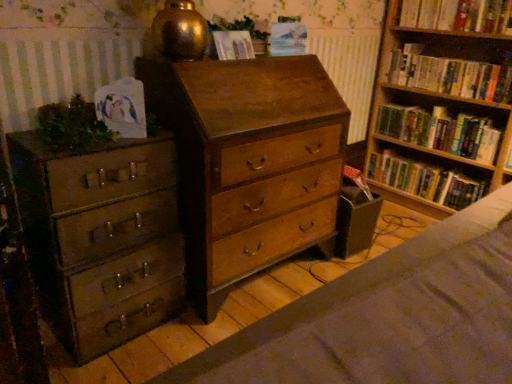
Question: Considering their positions, is wooden chest of drawers at center, acting as the second chest of drawers starting from the left, located in front of or behind hardcover books at right, which is the second book in top-to-bottom order?

Choices:
 (A) front
 (B) behind

Answer: (A)

Question: Looking at the image, does wooden chest of drawers at center, acting as the second chest of drawers starting from the left, seem bigger or smaller compared to hardcover books at right, marked as the third book in a bottom-to-top arrangement?

Choices:
 (A) small
 (B) big

Answer: (B)

Question: Estimate the real-world distances between objects in this image. Which object is closer to the wooden bookshelf at right, which ranks as the third book in top-to-bottom order?

Choices:
 (A) green matte plant at left, the second plant in the right-to-left sequence
 (B) hardcover book at upper right, the fourth book in the bottom-to-top sequence
 (C) hardcover books at right, marked as the third book in a bottom-to-top arrangement
 (D) hardcover book at right, the 1th book positioned from the bottom
 (E) matte paper at center, which ranks as the 1th paperback book in left-to-right order

Answer: (D)

Question: Which object is the closest to the hardcover book at upper right, the fourth book in the bottom-to-top sequence?

Choices:
 (A) matte green metal chest of drawers at left, the 2th chest of drawers when ordered from right to left
 (B) wooden chest of drawers at center, the first chest of drawers when ordered from right to left
 (C) green matte plant at left, positioned as the 1th plant in front-to-back order
 (D) green leafy plant at upper center, marked as the first plant in a back-to-front arrangement
 (E) wooden bookshelf at right, the 2th book in the bottom-to-top sequence

Answer: (E)